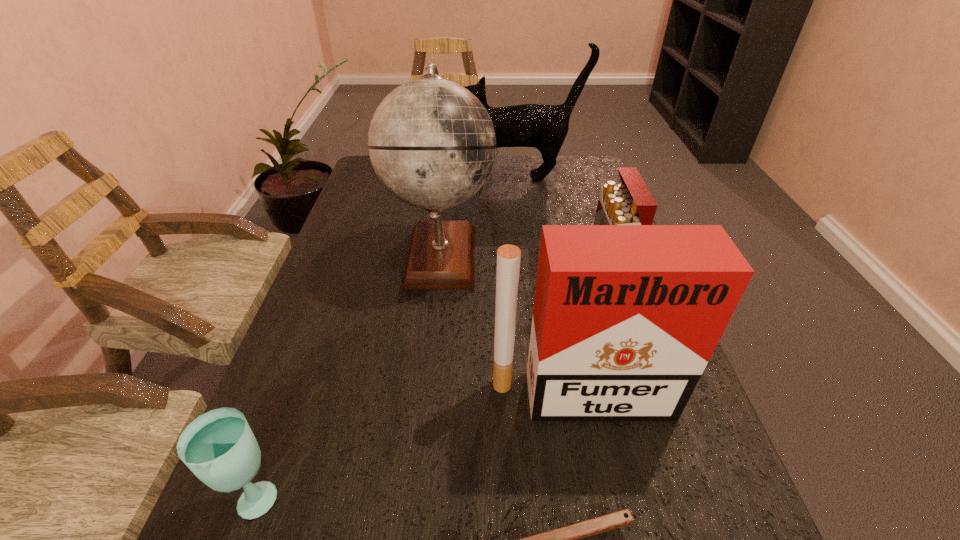
The image size is (960, 540). I want to click on object that is the closest to the glass, so click(565, 539).

Find the location of a particular element. object that is the fifth closest to the wooden spoon is located at coordinates (544, 127).

Locate an element on the screen. The width and height of the screenshot is (960, 540). blank space that satisfies the following two spatial constraints: 1. with the lid open on the shorter cigarette case; 2. on the front-facing side of the fourth farthest object is located at coordinates (x=646, y=396).